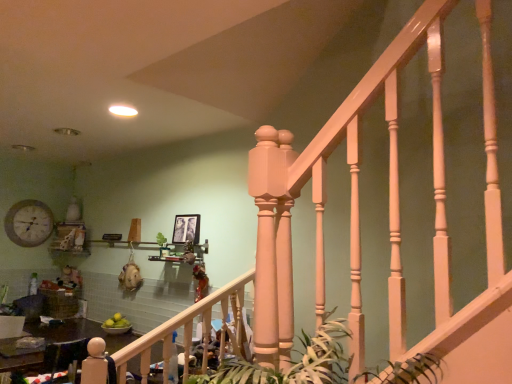
Question: Could you tell me if green leafy plant at center is facing black matte picture frame at upper center?

Choices:
 (A) no
 (B) yes

Answer: (A)

Question: From a real-world perspective, is green leafy plant at center positioned over black matte picture frame at upper center based on gravity?

Choices:
 (A) yes
 (B) no

Answer: (B)

Question: Is black matte picture frame at upper center completely or partially inside green leafy plant at center?

Choices:
 (A) no
 (B) yes

Answer: (A)

Question: From the image's perspective, does green leafy plant at center appear lower than black matte picture frame at upper center?

Choices:
 (A) no
 (B) yes

Answer: (B)

Question: Considering the relative sizes of green leafy plant at center and black matte picture frame at upper center in the image provided, is green leafy plant at center wider than black matte picture frame at upper center?

Choices:
 (A) yes
 (B) no

Answer: (A)

Question: Would you say matte white clock at upper left is inside or outside matte white railing at center?

Choices:
 (A) inside
 (B) outside

Answer: (B)

Question: In terms of height, does matte white clock at upper left look taller or shorter compared to matte white railing at center?

Choices:
 (A) tall
 (B) short

Answer: (B)

Question: Considering the positions of matte white clock at upper left and matte white railing at center in the image, is matte white clock at upper left wider or thinner than matte white railing at center?

Choices:
 (A) thin
 (B) wide

Answer: (A)

Question: Considering their positions, is matte white clock at upper left located in front of or behind matte white railing at center?

Choices:
 (A) behind
 (B) front

Answer: (A)

Question: Does point (129, 354) appear closer or farther from the camera than point (394, 375)?

Choices:
 (A) closer
 (B) farther

Answer: (B)

Question: Is matte white railing at center to the left or to the right of green leafy plant at center in the image?

Choices:
 (A) right
 (B) left

Answer: (B)

Question: From the image's perspective, is matte white railing at center above or below green leafy plant at center?

Choices:
 (A) below
 (B) above

Answer: (A)

Question: From a real-world perspective, is matte white railing at center above or below green leafy plant at center?

Choices:
 (A) below
 (B) above

Answer: (A)

Question: In the image, is green leafy plant at center positioned in front of or behind matte white clock at upper left?

Choices:
 (A) front
 (B) behind

Answer: (A)

Question: Is green leafy plant at center situated inside matte white clock at upper left or outside?

Choices:
 (A) outside
 (B) inside

Answer: (A)